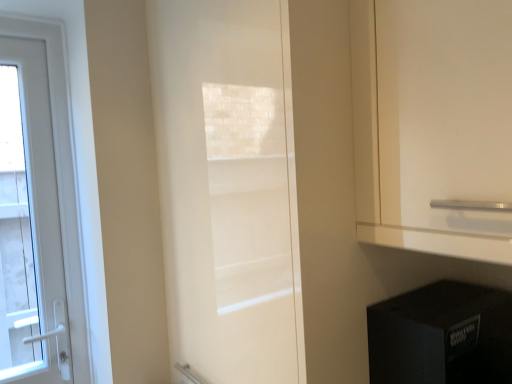
Question: Which direction should I rotate to look at white glossy door at center, positioned as the 2th door in left-to-right order, — up or down?

Choices:
 (A) up
 (B) down

Answer: (A)

Question: Is black plastic speaker at lower right to the right of white glossy door at left, marked as the second door in a front-to-back arrangement, from the viewer's perspective?

Choices:
 (A) yes
 (B) no

Answer: (A)

Question: Could white glossy door at left, acting as the first door starting from the left, be considered to be inside black plastic speaker at lower right?

Choices:
 (A) yes
 (B) no

Answer: (B)

Question: Does black plastic speaker at lower right turn towards white glossy door at left, acting as the first door starting from the left?

Choices:
 (A) no
 (B) yes

Answer: (A)

Question: From a real-world perspective, does black plastic speaker at lower right sit lower than white glossy door at left, acting as the first door starting from the left?

Choices:
 (A) yes
 (B) no

Answer: (A)

Question: From the image's perspective, is black plastic speaker at lower right below white glossy door at left, placed as the 1th door when sorted from back to front?

Choices:
 (A) yes
 (B) no

Answer: (A)

Question: From the image's perspective, would you say black plastic speaker at lower right is positioned over white glossy door at left, placed as the 1th door when sorted from back to front?

Choices:
 (A) yes
 (B) no

Answer: (B)

Question: Considering the relative sizes of white glossy door at center, positioned as the 2th door in left-to-right order, and black plastic speaker at lower right in the image provided, is white glossy door at center, positioned as the 2th door in left-to-right order, smaller than black plastic speaker at lower right?

Choices:
 (A) no
 (B) yes

Answer: (A)

Question: Are white glossy door at center, which is the 1th door in front-to-back order, and black plastic speaker at lower right far apart?

Choices:
 (A) yes
 (B) no

Answer: (B)

Question: Is white glossy door at center, positioned as the 2th door in left-to-right order, positioned with its back to black plastic speaker at lower right?

Choices:
 (A) no
 (B) yes

Answer: (A)

Question: Could you tell me if white glossy door at center, marked as the 1th door in a right-to-left arrangement, is facing black plastic speaker at lower right?

Choices:
 (A) no
 (B) yes

Answer: (A)

Question: Can you confirm if white glossy door at center, marked as the 1th door in a right-to-left arrangement, is positioned to the left of black plastic speaker at lower right?

Choices:
 (A) no
 (B) yes

Answer: (B)

Question: Does white glossy door at center, positioned as the 2th door in left-to-right order, come in front of black plastic speaker at lower right?

Choices:
 (A) no
 (B) yes

Answer: (B)

Question: Is black plastic speaker at lower right outside white glossy door at center, marked as the 1th door in a right-to-left arrangement?

Choices:
 (A) yes
 (B) no

Answer: (A)